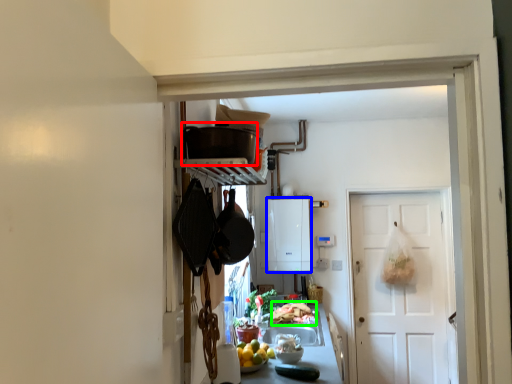
Question: Which is nearer to the appliance (highlighted by a red box)? appliance (highlighted by a blue box) or food (highlighted by a green box).

Choices:
 (A) appliance
 (B) food

Answer: (B)